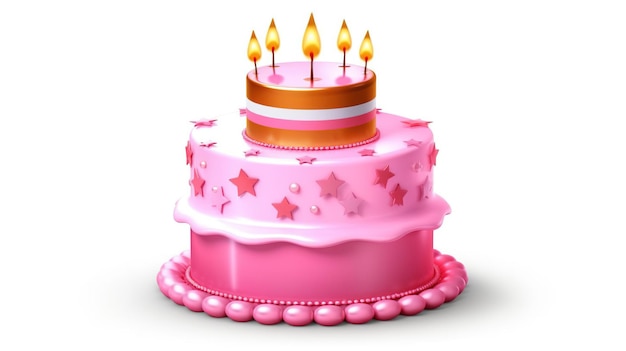
Find the location of a particular element. This screenshot has height=351, width=626. gold trim is located at coordinates (319, 96), (322, 136).